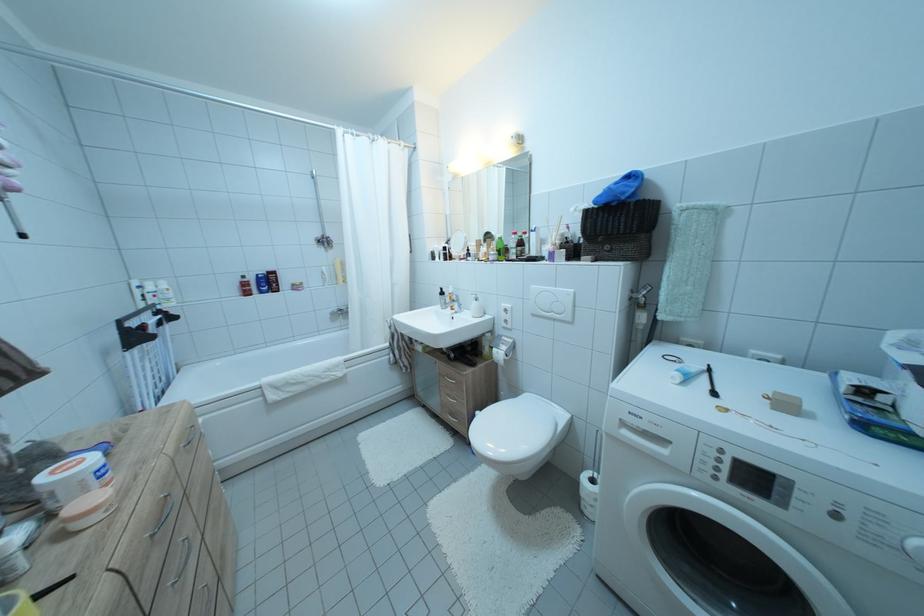
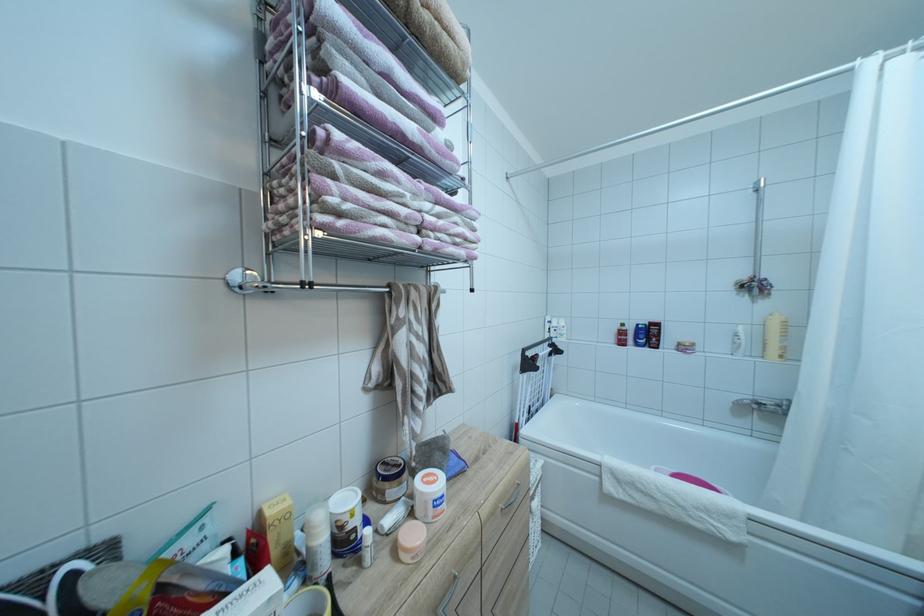
In the second image, find the point that corresponds to point 347,285 in the first image.

(781, 357)